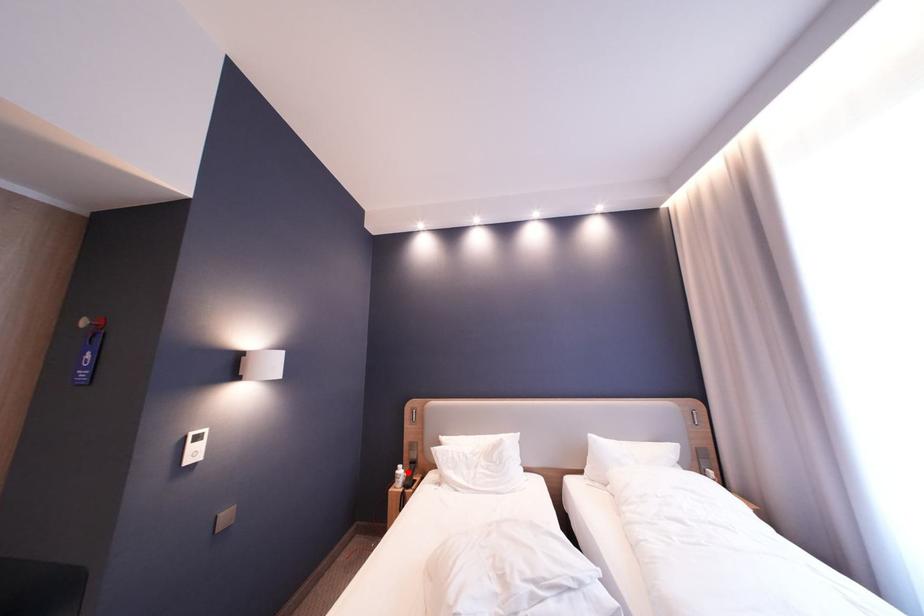
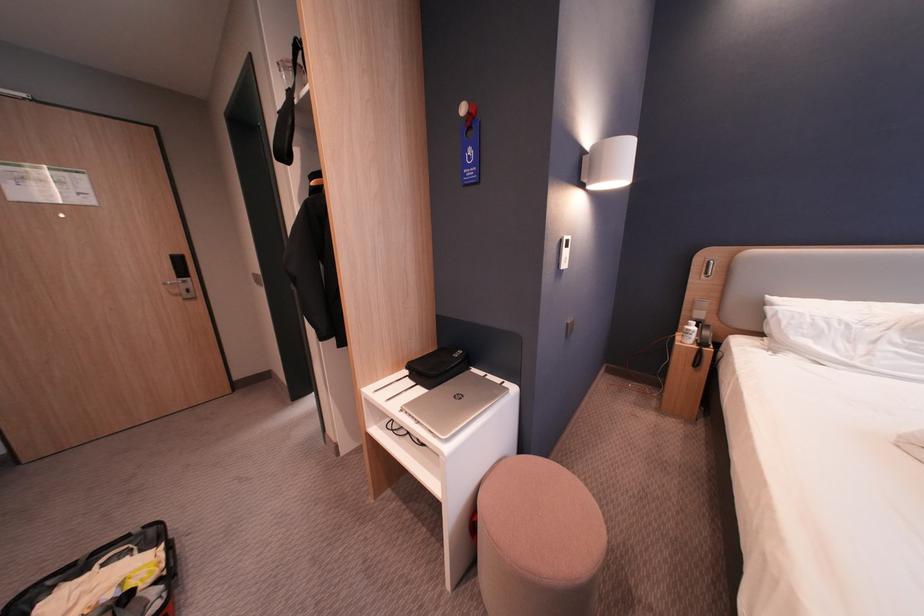
The point at the highlighted location is marked in the first image. Where is the corresponding point in the second image?

(698, 328)